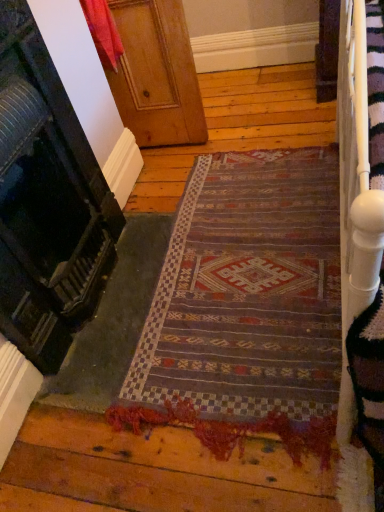
Question: Looking at their shapes, would you say textured woolen mat at center is wider or thinner than wooden at left, the first door positioned from the top?

Choices:
 (A) wide
 (B) thin

Answer: (A)

Question: Is textured woolen mat at center in front of or behind wooden at left, the first door positioned from the top, in the image?

Choices:
 (A) front
 (B) behind

Answer: (A)

Question: Which is farther from the wooden at left, the first door positioned from the top?

Choices:
 (A) textured woolen mat at center
 (B) wooden door at upper center, the 1th door in the bottom-to-top sequence

Answer: (A)

Question: Estimate the real-world distances between objects in this image. Which object is farther from the textured woolen mat at center?

Choices:
 (A) wooden door at upper center, the 1th door in the bottom-to-top sequence
 (B) wooden at left, which is the second door in bottom-to-top order

Answer: (B)